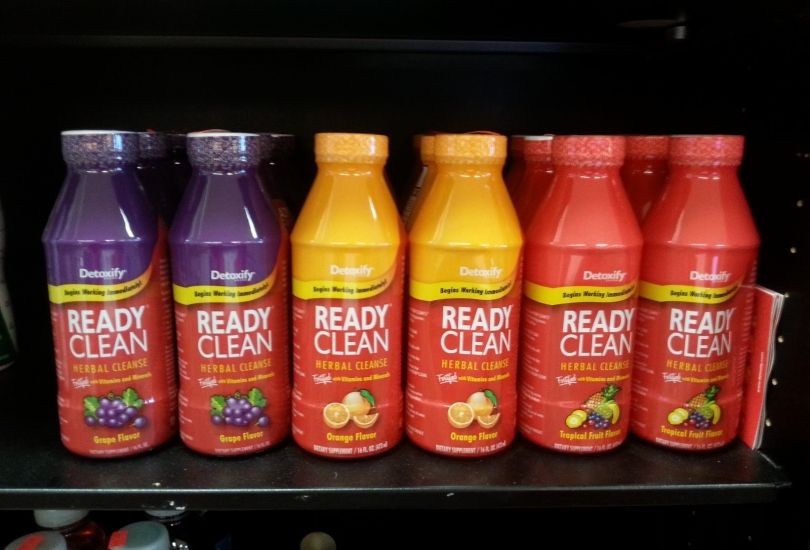
The height and width of the screenshot is (550, 810). Find the location of `shelf`. shelf is located at coordinates (231, 480).